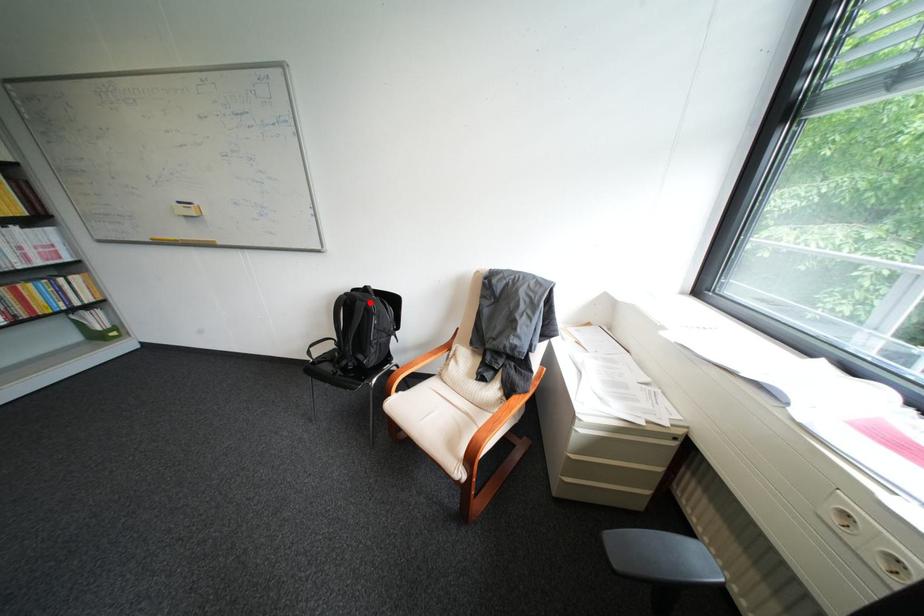
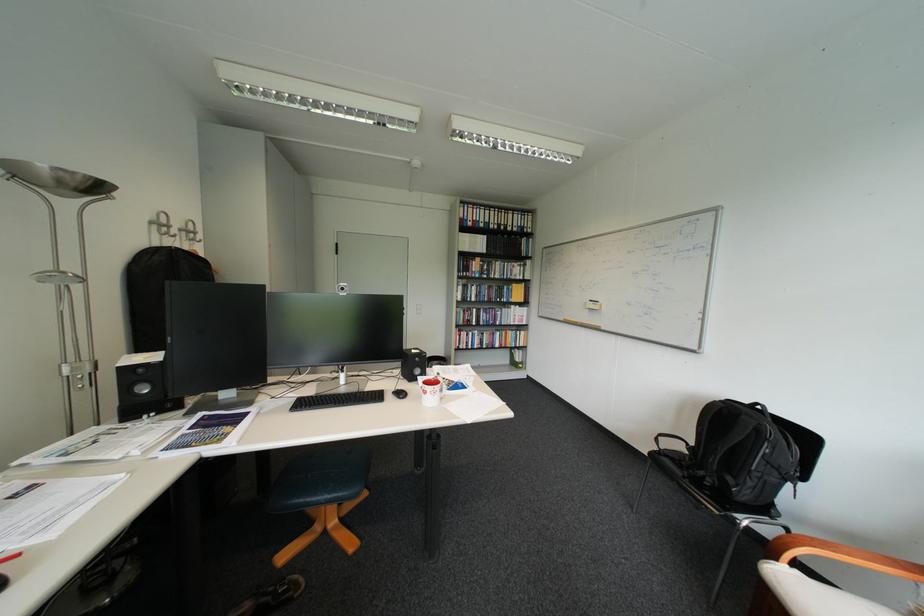
The point at the highlighted location is marked in the first image. Where is the corresponding point in the second image?

(756, 418)